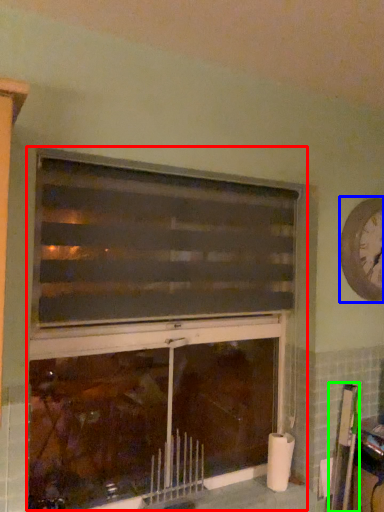
Question: Which object is the closest to the fireplace (highlighted by a red box)? Choose among these: clock (highlighted by a blue box) or bulletin board (highlighted by a green box).

Choices:
 (A) clock
 (B) bulletin board

Answer: (A)